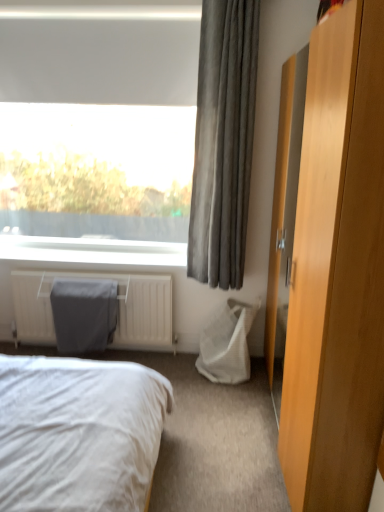
Question: Is gray fabric curtain at upper right taller than matte fabric radiator cover at lower left?

Choices:
 (A) yes
 (B) no

Answer: (A)

Question: Is gray fabric curtain at upper right positioned behind matte fabric radiator cover at lower left?

Choices:
 (A) no
 (B) yes

Answer: (A)

Question: Can you confirm if gray fabric curtain at upper right is wider than matte fabric radiator cover at lower left?

Choices:
 (A) no
 (B) yes

Answer: (B)

Question: From the image's perspective, is gray fabric curtain at upper right below matte fabric radiator cover at lower left?

Choices:
 (A) yes
 (B) no

Answer: (B)

Question: Is gray fabric curtain at upper right placed right next to matte fabric radiator cover at lower left?

Choices:
 (A) no
 (B) yes

Answer: (A)

Question: Considering the relative positions of light brown wood dresser at right and white fabric bed at lower left in the image provided, is light brown wood dresser at right to the left or to the right of white fabric bed at lower left?

Choices:
 (A) right
 (B) left

Answer: (A)

Question: Is light brown wood dresser at right wider or thinner than white fabric bed at lower left?

Choices:
 (A) wide
 (B) thin

Answer: (B)

Question: Considering the positions of point (314, 93) and point (109, 463), is point (314, 93) closer or farther from the camera than point (109, 463)?

Choices:
 (A) closer
 (B) farther

Answer: (B)

Question: From the image's perspective, relative to white fabric bed at lower left, is light brown wood dresser at right above or below?

Choices:
 (A) below
 (B) above

Answer: (B)

Question: Considering the relative positions of white fabric bed at lower left and matte fabric radiator cover at lower left in the image provided, is white fabric bed at lower left to the left or to the right of matte fabric radiator cover at lower left?

Choices:
 (A) left
 (B) right

Answer: (B)

Question: Looking at the image, does white fabric bed at lower left seem bigger or smaller compared to matte fabric radiator cover at lower left?

Choices:
 (A) big
 (B) small

Answer: (A)

Question: From the image's perspective, is white fabric bed at lower left located above or below matte fabric radiator cover at lower left?

Choices:
 (A) above
 (B) below

Answer: (B)

Question: Choose the correct answer: Is white fabric bed at lower left inside matte fabric radiator cover at lower left or outside it?

Choices:
 (A) outside
 (B) inside

Answer: (A)

Question: Is light brown wood dresser at right inside the boundaries of gray fabric curtain at upper right, or outside?

Choices:
 (A) inside
 (B) outside

Answer: (B)

Question: Considering the positions of light brown wood dresser at right and gray fabric curtain at upper right in the image, is light brown wood dresser at right bigger or smaller than gray fabric curtain at upper right?

Choices:
 (A) small
 (B) big

Answer: (B)